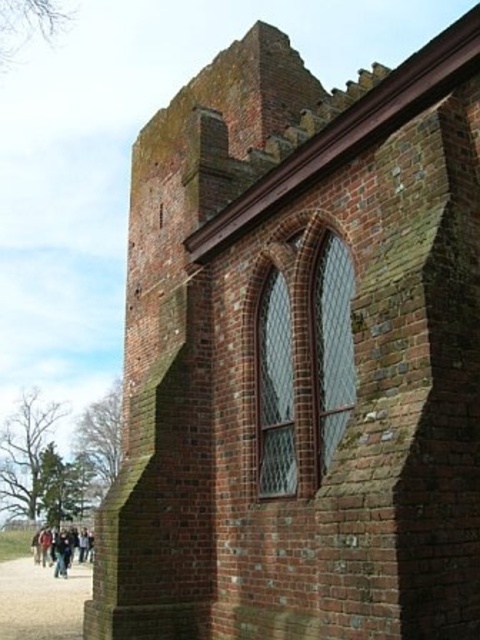
Can you confirm if brown gravel path at lower left is positioned below dark blue jeans at lower left?

Actually, brown gravel path at lower left is above dark blue jeans at lower left.

Which is in front, point (41, 572) or point (49, 531)?

Point (41, 572) is more forward.

I want to click on brown gravel path at lower left, so click(41, 600).